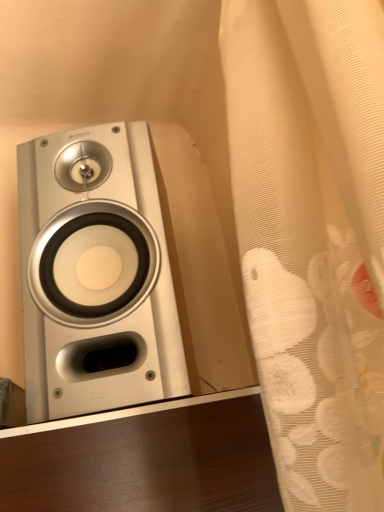
In order to face silver metallic speaker at left, should I rotate leftwards or rightwards?

Rotate your view left by about 11.019°.

Identify the location of silver metallic speaker at left. (96, 275).

This screenshot has width=384, height=512. Describe the element at coordinates (96, 275) in the screenshot. I see `silver metallic speaker at left` at that location.

The width and height of the screenshot is (384, 512). Describe the element at coordinates (312, 234) in the screenshot. I see `white sheer curtain at right` at that location.

What is the approximate width of white sheer curtain at right?

white sheer curtain at right is 6.11 inches wide.

This screenshot has height=512, width=384. I want to click on white sheer curtain at right, so click(312, 234).

The height and width of the screenshot is (512, 384). In order to click on silver metallic speaker at left in this screenshot , I will do `click(96, 275)`.

Which is more to the right, white sheer curtain at right or silver metallic speaker at left?

white sheer curtain at right.

Between white sheer curtain at right and silver metallic speaker at left, which one is positioned behind?

silver metallic speaker at left is more distant.

Does point (285, 169) come in front of point (78, 165)?

Yes.

From the image's perspective, which is below, white sheer curtain at right or silver metallic speaker at left?

From the image's view, silver metallic speaker at left is below.

From a real-world perspective, is white sheer curtain at right positioned over silver metallic speaker at left based on gravity?

Actually, white sheer curtain at right is physically below silver metallic speaker at left in the real world.

Can you confirm if white sheer curtain at right is thinner than silver metallic speaker at left?

Yes.

Between white sheer curtain at right and silver metallic speaker at left, which one has less height?

silver metallic speaker at left is shorter.

From the picture: Between white sheer curtain at right and silver metallic speaker at left, which one has smaller size?

Smaller between the two is white sheer curtain at right.

Does white sheer curtain at right contain silver metallic speaker at left?

No.

Are white sheer curtain at right and silver metallic speaker at left located far from each other?

white sheer curtain at right is near silver metallic speaker at left, not far away.

Is white sheer curtain at right oriented away from silver metallic speaker at left?

white sheer curtain at right is not turned away from silver metallic speaker at left.

What's the angular difference between white sheer curtain at right and silver metallic speaker at left's facing directions?

The angle between the facing direction of white sheer curtain at right and the facing direction of silver metallic speaker at left is 75.2 degrees.

This screenshot has width=384, height=512. Identify the location of home appliance that appears behind the white sheer curtain at right. (96, 275).

Is silver metallic speaker at left to the right of white sheer curtain at right from the viewer's perspective?

No, silver metallic speaker at left is not to the right of white sheer curtain at right.

Is silver metallic speaker at left closer to camera compared to white sheer curtain at right?

No, silver metallic speaker at left is behind white sheer curtain at right.

Which is in front, point (74, 347) or point (264, 345)?

The point (264, 345) is in front.

From the image's perspective, relative to white sheer curtain at right, is silver metallic speaker at left above or below?

From the image's perspective, silver metallic speaker at left appears below white sheer curtain at right.

From a real-world perspective, between silver metallic speaker at left and white sheer curtain at right, who is vertically lower?

In real-world perspective, white sheer curtain at right is lower.

Is silver metallic speaker at left wider or thinner than white sheer curtain at right?

silver metallic speaker at left is wider than white sheer curtain at right.

Between silver metallic speaker at left and white sheer curtain at right, which one has less height?

Standing shorter between the two is silver metallic speaker at left.

Is silver metallic speaker at left bigger than white sheer curtain at right?

Indeed, silver metallic speaker at left has a larger size compared to white sheer curtain at right.

Is white sheer curtain at right completely or partially inside silver metallic speaker at left?

No, white sheer curtain at right is located outside of silver metallic speaker at left.

Is silver metallic speaker at left positioned far away from white sheer curtain at right?

No, there isn't a large distance between silver metallic speaker at left and white sheer curtain at right.

Is silver metallic speaker at left facing towards white sheer curtain at right?

No, silver metallic speaker at left is not oriented towards white sheer curtain at right.

What's the angular difference between silver metallic speaker at left and white sheer curtain at right's facing directions?

silver metallic speaker at left and white sheer curtain at right are facing 75.2 degrees away from each other.

Where is `home appliance that is on the left side of white sheer curtain at right`? home appliance that is on the left side of white sheer curtain at right is located at coordinates (96, 275).

The width and height of the screenshot is (384, 512). In the image, there is a white sheer curtain at right. Find the location of `home appliance below it (from the image's perspective)`. home appliance below it (from the image's perspective) is located at coordinates (96, 275).

What are the coordinates of `home appliance on the left of white sheer curtain at right` in the screenshot? It's located at (96, 275).